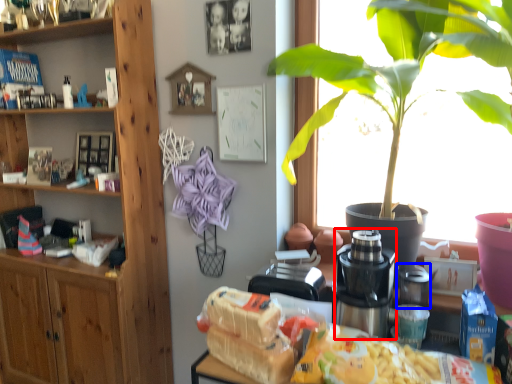
Question: Which point is closer to the camera, coffee machine (highlighted by a red box) or appliance (highlighted by a blue box)?

Choices:
 (A) coffee machine
 (B) appliance

Answer: (A)